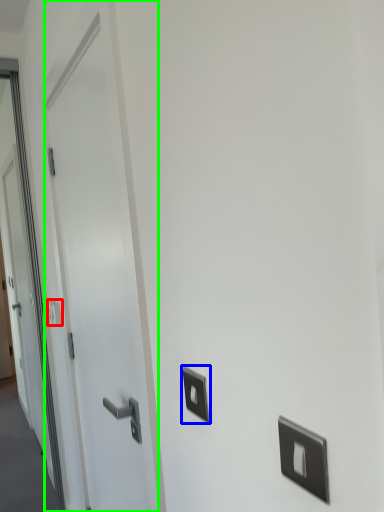
Question: Which object is positioned closest to light switch (highlighted by a red box)? Select from light switch (highlighted by a blue box) and door (highlighted by a green box).

Choices:
 (A) light switch
 (B) door

Answer: (B)